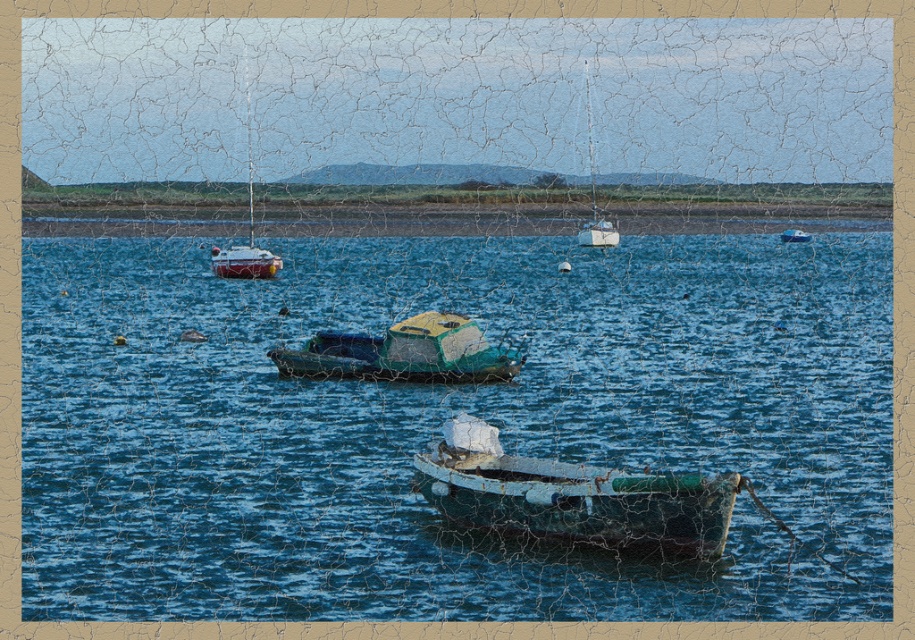
Question: Which point is farther to the camera?

Choices:
 (A) green matte boat at center
 (B) blue water at center
 (C) rusty metal boat at center

Answer: (A)

Question: Which of the following is the closest to the observer?

Choices:
 (A) blue water at center
 (B) rusty metal boat at center
 (C) white plastic boat at center

Answer: (A)

Question: Can you confirm if rusty metal boat at center is positioned below white plastic boat at center?

Choices:
 (A) yes
 (B) no

Answer: (A)

Question: Which of the following is the farthest from the observer?

Choices:
 (A) white plastic boat at center
 (B) rusty metal boat at center
 (C) blue water at center

Answer: (A)

Question: Can you confirm if blue water at center is wider than rusty metal boat at center?

Choices:
 (A) yes
 (B) no

Answer: (A)

Question: Is rusty metal boat at center to the right of white plastic boat at center from the viewer's perspective?

Choices:
 (A) no
 (B) yes

Answer: (A)